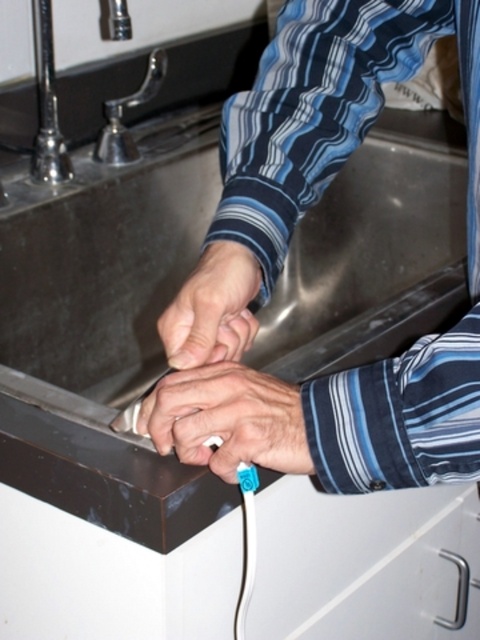
Question: From the image, what is the correct spatial relationship of blue striped shirt at center in relation to polished chrome faucet at upper left?

Choices:
 (A) left
 (B) right

Answer: (B)

Question: Which of the following is the farthest from the observer?

Choices:
 (A) blue striped shirt at center
 (B) smooth skin hand at center
 (C) blue rubber band at center

Answer: (B)

Question: Can you confirm if blue rubber band at center is positioned to the left of smooth skin hand at center?

Choices:
 (A) no
 (B) yes

Answer: (B)

Question: Does blue rubber band at center appear under polished chrome faucet at upper left?

Choices:
 (A) yes
 (B) no

Answer: (A)

Question: Which point is farther from the camera taking this photo?

Choices:
 (A) (241, 244)
 (B) (220, 381)
 (C) (192, 419)

Answer: (A)

Question: Which of the following is the farthest from the observer?

Choices:
 (A) blue striped shirt at center
 (B) smooth skin hand at center
 (C) blue rubber band at center
 (D) polished chrome faucet at upper left

Answer: (D)